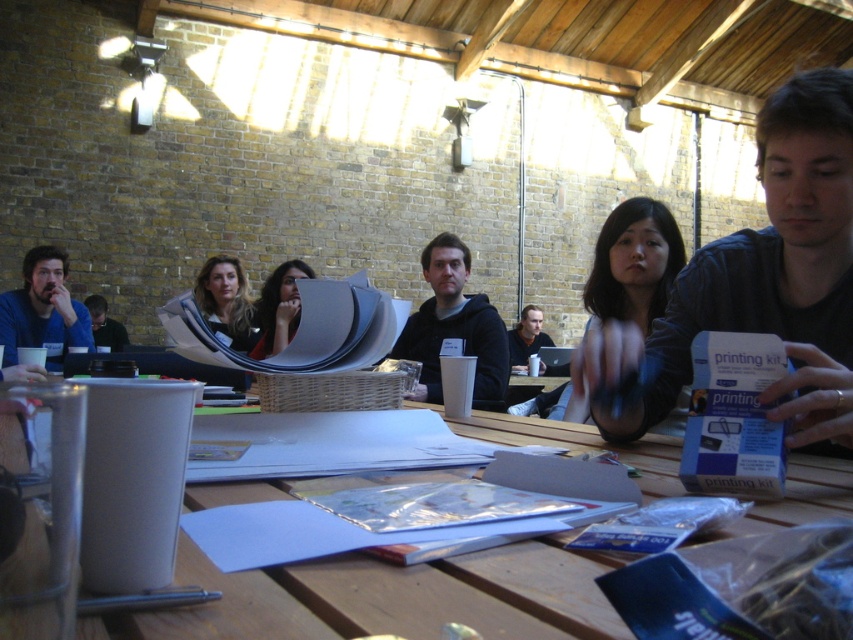
Question: Which of the following is the closest to the observer?

Choices:
 (A) [x=457, y=269]
 (B) [x=90, y=298]

Answer: (A)

Question: Is the position of matte black paper at center more distant than that of matte black laptop at center?

Choices:
 (A) yes
 (B) no

Answer: (B)

Question: Does matte black paper at center appear on the right side of matte black laptop at left?

Choices:
 (A) no
 (B) yes

Answer: (B)

Question: Among these points, which one is nearest to the camera?

Choices:
 (A) (291, 276)
 (B) (199, 275)
 (C) (474, 330)
 (D) (509, 337)

Answer: (C)

Question: Can you confirm if matte black printing kit at center is positioned to the left of matte black laptop at left?

Choices:
 (A) yes
 (B) no

Answer: (B)

Question: Among these points, which one is nearest to the camera?

Choices:
 (A) (227, 275)
 (B) (498, 371)
 (C) (529, 353)

Answer: (B)